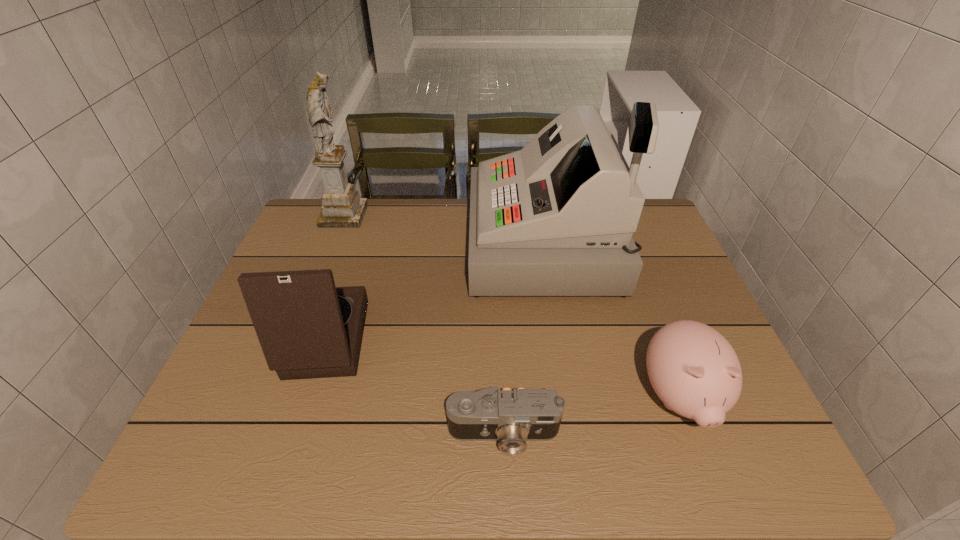
Image resolution: width=960 pixels, height=540 pixels. Identify the location of cash register positioned at the far edge. (556, 218).

Identify the location of sculpture at the far edge. The width and height of the screenshot is (960, 540). (342, 207).

The image size is (960, 540). Identify the location of piggy bank positioned at the near edge. (693, 369).

This screenshot has height=540, width=960. In order to click on camera present at the near edge in this screenshot , I will do `click(512, 417)`.

The height and width of the screenshot is (540, 960). In order to click on sculpture that is at the left edge in this screenshot , I will do `click(342, 207)`.

Locate an element on the screen. phonograph record that is at the left edge is located at coordinates (307, 328).

I want to click on cash register at the right edge, so click(x=556, y=218).

You are a GUI agent. You are given a task and a screenshot of the screen. Output one action in this format:
    pyautogui.click(x=<x>, y=<y>)
    Task: Click on the piggy bank at the right edge
    The height and width of the screenshot is (540, 960).
    Given the screenshot: What is the action you would take?
    pyautogui.click(x=693, y=369)

This screenshot has height=540, width=960. In order to click on object that is positioned at the far left corner in this screenshot , I will do `click(342, 207)`.

The width and height of the screenshot is (960, 540). I want to click on object at the far right corner, so click(556, 218).